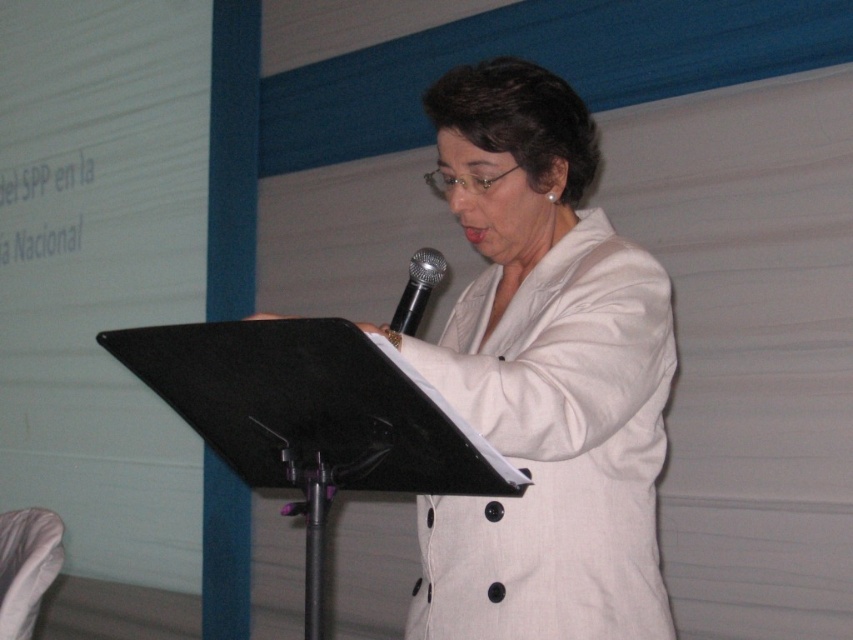
Question: Does white fabric coat at center have a larger size compared to black metallic microphone at center?

Choices:
 (A) no
 (B) yes

Answer: (B)

Question: Which point appears closest to the camera in this image?

Choices:
 (A) (433, 346)
 (B) (416, 312)

Answer: (A)

Question: Is white fabric coat at center wider than black metallic microphone at center?

Choices:
 (A) yes
 (B) no

Answer: (A)

Question: Is the position of white fabric coat at center more distant than that of black metallic microphone at center?

Choices:
 (A) no
 (B) yes

Answer: (A)

Question: Which point is closer to the camera?

Choices:
 (A) black metallic microphone at center
 (B) white fabric coat at center

Answer: (B)